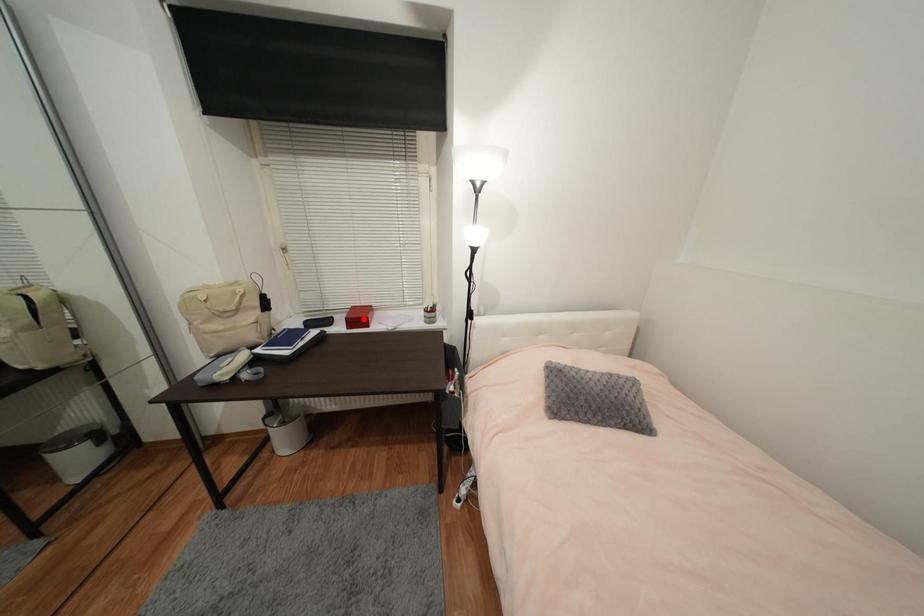
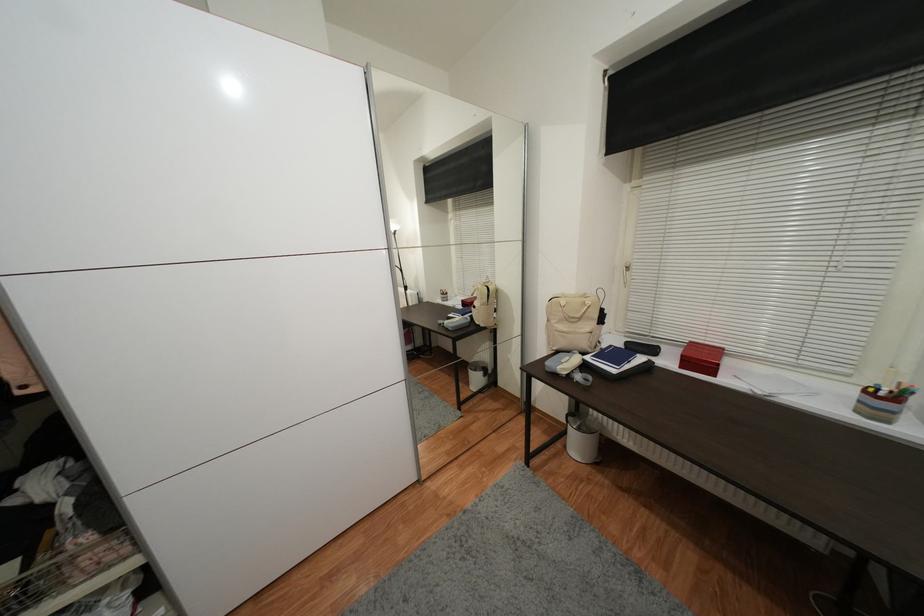
Locate, in the second image, the point that corresponds to the highlighted location in the first image.

(706, 361)